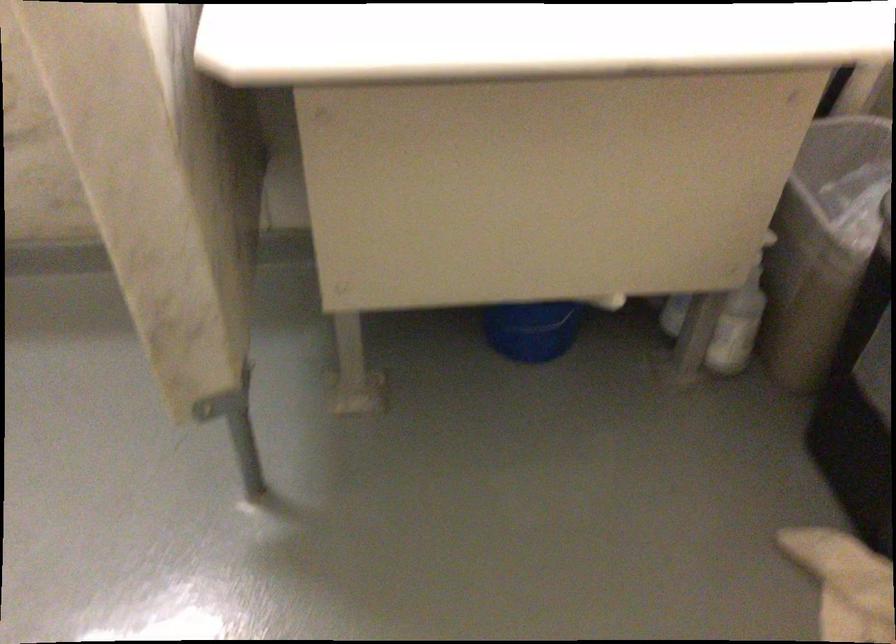
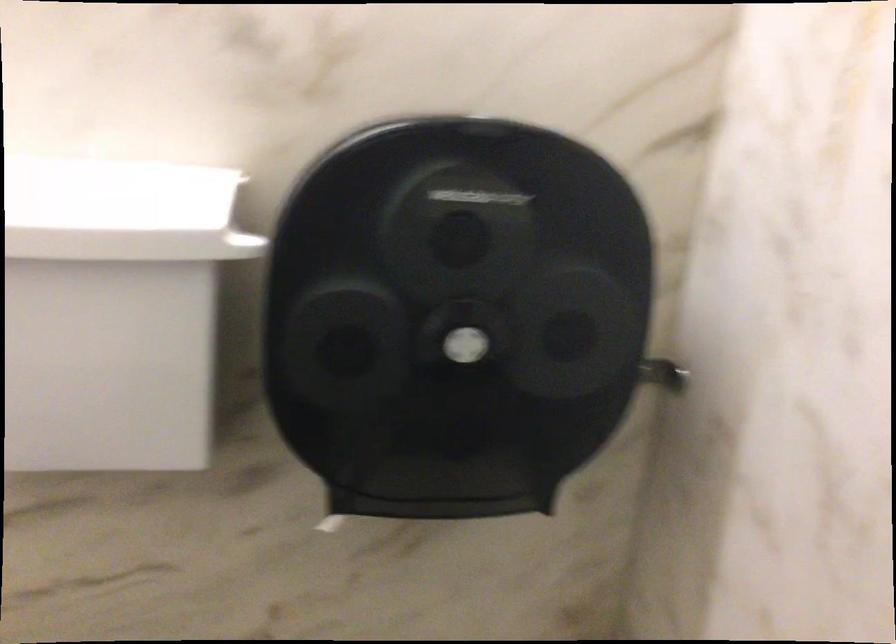
Question: The images are taken continuously from a first-person perspective. In which direction is your viewpoint rotating?

Choices:
 (A) Left
 (B) Right
 (C) Up
 (D) Down

Answer: (C)